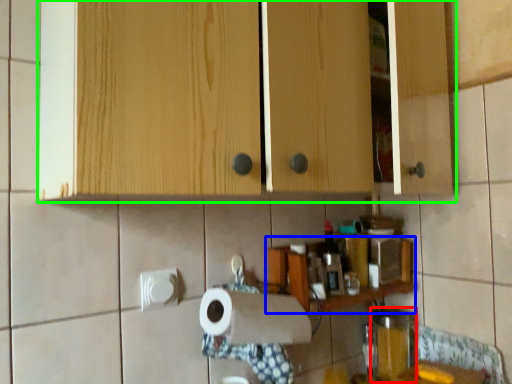
Question: Which object is the farthest from appliance (highlighted by a red box)? Choose among these: shelf (highlighted by a blue box) or cabinetry (highlighted by a green box).

Choices:
 (A) shelf
 (B) cabinetry

Answer: (B)